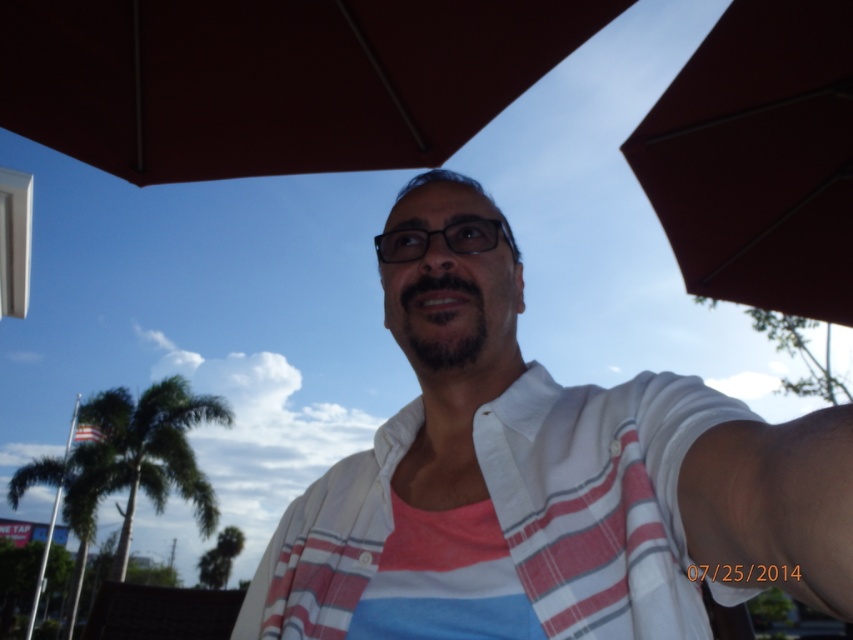
Who is shorter, white striped shirt at center or green leafy palm tree at lower left?

With less height is white striped shirt at center.

Does white striped shirt at center come behind green leafy palm tree at lower left?

No, it is not.

The width and height of the screenshot is (853, 640). In order to click on white striped shirt at center in this screenshot , I will do `click(548, 492)`.

Where is `white striped shirt at center`? This screenshot has height=640, width=853. white striped shirt at center is located at coordinates (548, 492).

Is brown matte umbrella at upper center bigger than black plastic glasses at center?

Yes, brown matte umbrella at upper center is bigger than black plastic glasses at center.

Is brown matte umbrella at upper center taller than black plastic glasses at center?

Correct, brown matte umbrella at upper center is much taller as black plastic glasses at center.

Is point (410, 102) farther from viewer compared to point (444, 227)?

Yes, point (410, 102) is farther from viewer.

Find the location of a particular element. brown matte umbrella at upper center is located at coordinates (273, 77).

Is green leafy palm tree at lower left shorter than black plastic glasses at center?

Incorrect, green leafy palm tree at lower left's height does not fall short of black plastic glasses at center's.

Can you confirm if green leafy palm tree at lower left is positioned above black plastic glasses at center?

No.

Between point (184, 468) and point (393, 236), which one is positioned behind?

The point (184, 468) is behind.

Locate an element on the screen. This screenshot has width=853, height=640. green leafy palm tree at lower left is located at coordinates (143, 456).